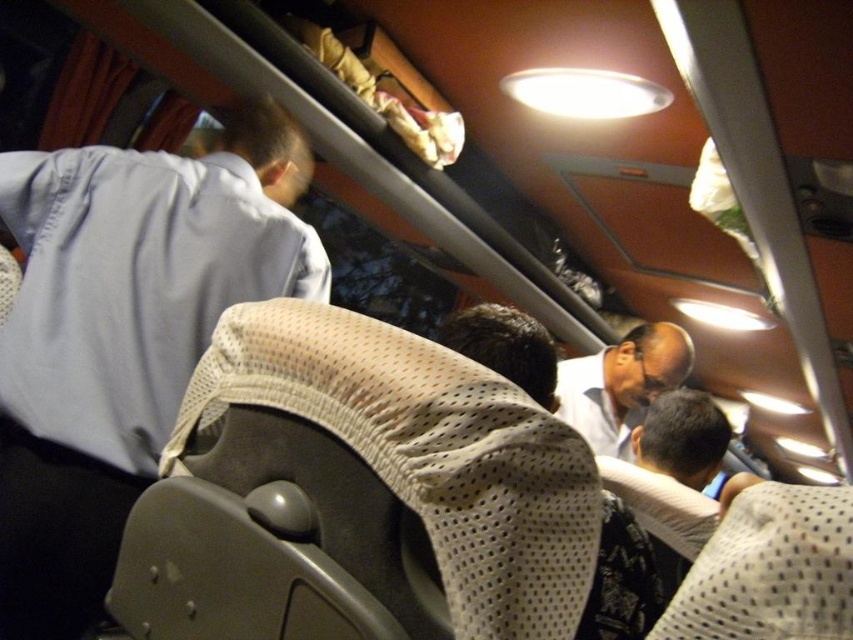
Question: Which point appears farthest from the camera in this image?

Choices:
 (A) (267, 276)
 (B) (567, 365)

Answer: (B)

Question: Which object appears closest to the camera in this image?

Choices:
 (A) light blue fabric shirt at upper left
 (B) white shirt at center

Answer: (A)

Question: Does light blue fabric shirt at upper left appear over white shirt at center?

Choices:
 (A) yes
 (B) no

Answer: (A)

Question: Does light blue fabric shirt at upper left appear under white shirt at center?

Choices:
 (A) yes
 (B) no

Answer: (B)

Question: Is light blue fabric shirt at upper left below white shirt at center?

Choices:
 (A) yes
 (B) no

Answer: (B)